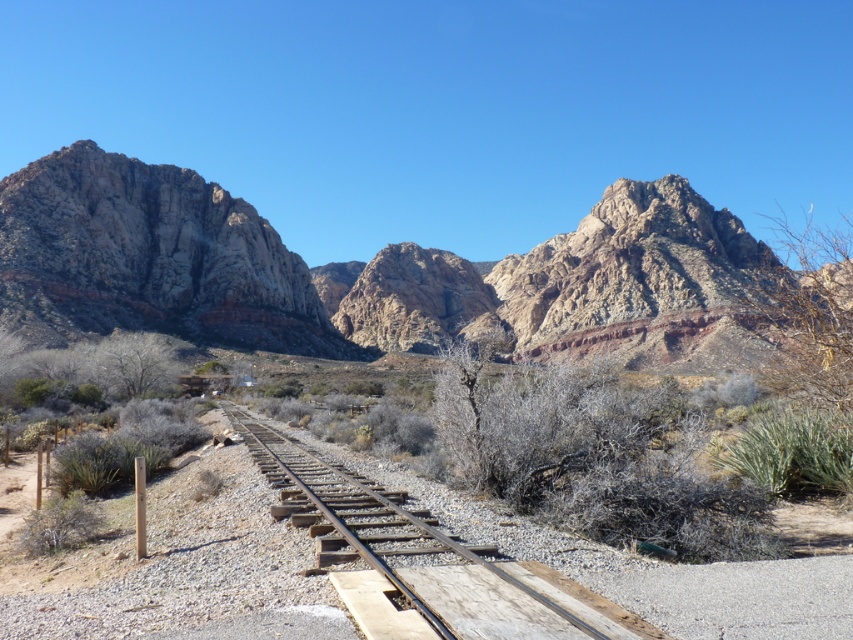
You are a hiker planning to take a photo of the rugged rock mountain range at upper left and the rugged rock formation at left. Which of the two objects should you focus on to capture the most detailed image?

The rugged rock mountain range at upper left should be focused on because it has a larger size compared to the rugged rock formation at left, allowing for more detailed capture.